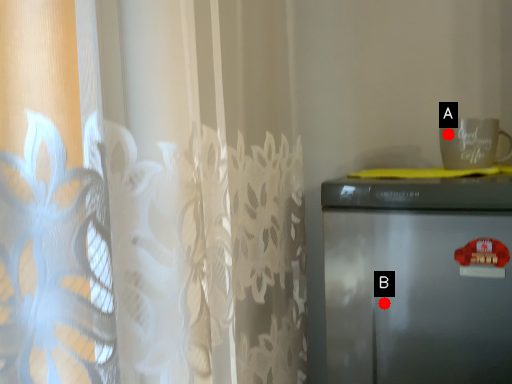
Question: Two points are circled on the image, labeled by A and B beside each circle. Which of the following is the farthest from the observer?

Choices:
 (A) A is further
 (B) B is further

Answer: (A)